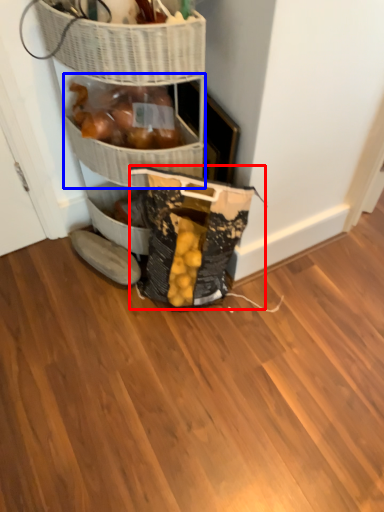
Question: Which point is closer to the camera, material (highlighted by a red box) or basket (highlighted by a blue box)?

Choices:
 (A) material
 (B) basket

Answer: (A)